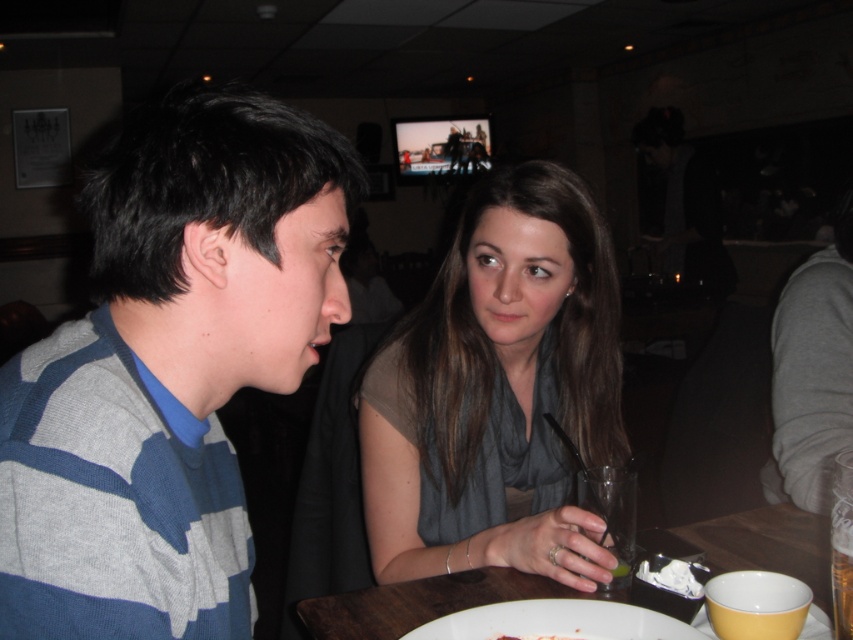
You are a waiter in a restaurant and need to place a new order of a salad on the table. The salad comes with a dressing bottle that requires a space wider than the clear glass at lower center. Can the smooth white plate at center accommodate the dressing bottle?

The clear glass at lower center has a larger width than the smooth white plate at center. Since the dressing bottle requires a space wider than the clear glass, the smooth white plate at center cannot accommodate it as it is narrower.

You are a waiter in a restaurant and need to serve a customer. The customer asks for a drink. You have a clear glass at lower center and a smooth white plate at center. Which item should you use to serve the drink?

The clear glass at lower center should be used to serve the drink because it is bigger than the smooth white plate at center, making it more suitable for holding beverages.

You are a fashion designer analyzing the clothing items in the image. You need to determine which clothing item is wider between the striped knit sweater at left and the matte gray scarf at center. Which one is wider?

The matte gray scarf at center is wider than the striped knit sweater at left according to the description.